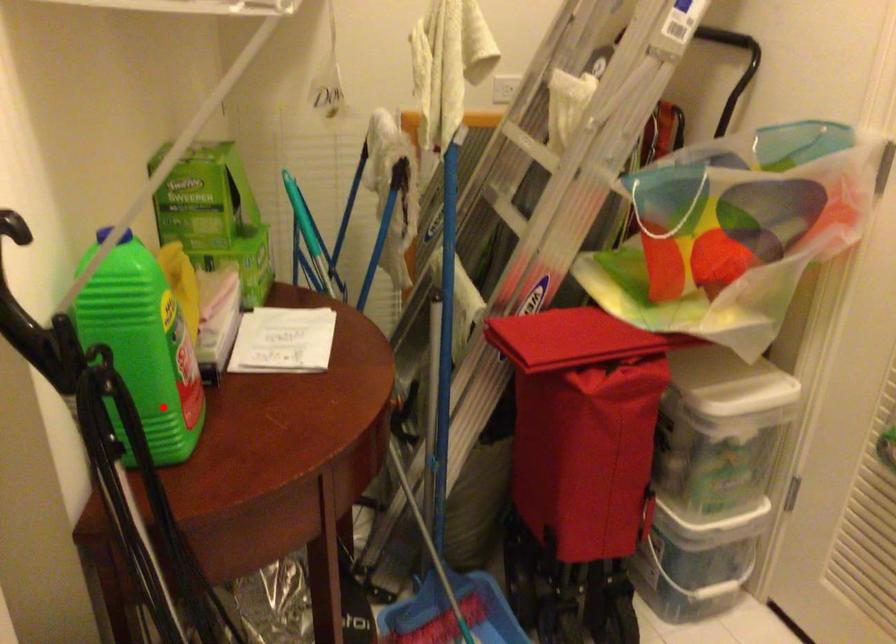
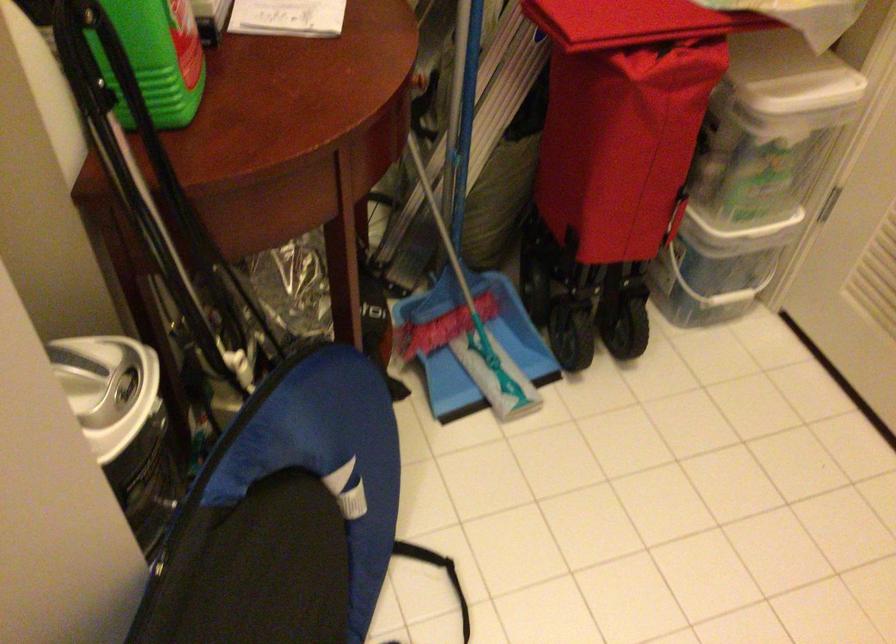
Find the pixel in the second image that matches the highlighted location in the first image.

(156, 59)